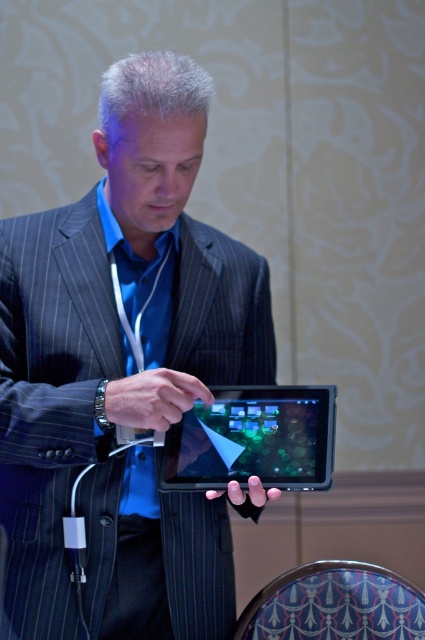
You are a photographer positioned in front of the scene. You want to capture a clear photo of the shiny black tablet at center without the matte black suit at center blocking it. Is this possible given their positions?

The matte black suit at center is closer to the viewer than the shiny black tablet at center, so the suit will block the tablet in the photo unless you adjust your angle or move closer to avoid the obstruction.

You are organizing a tech conference and need to ensure that the matte black suit at center worn by the presenter can be clearly seen by the audience. Given that the shiny black tablet at center is also part of the presentation, which object should you focus the spotlight on to ensure visibility?

The matte black suit at center is bigger than the shiny black tablet at center, so focusing the spotlight on the matte black suit at center would ensure it is clearly visible to the audience.